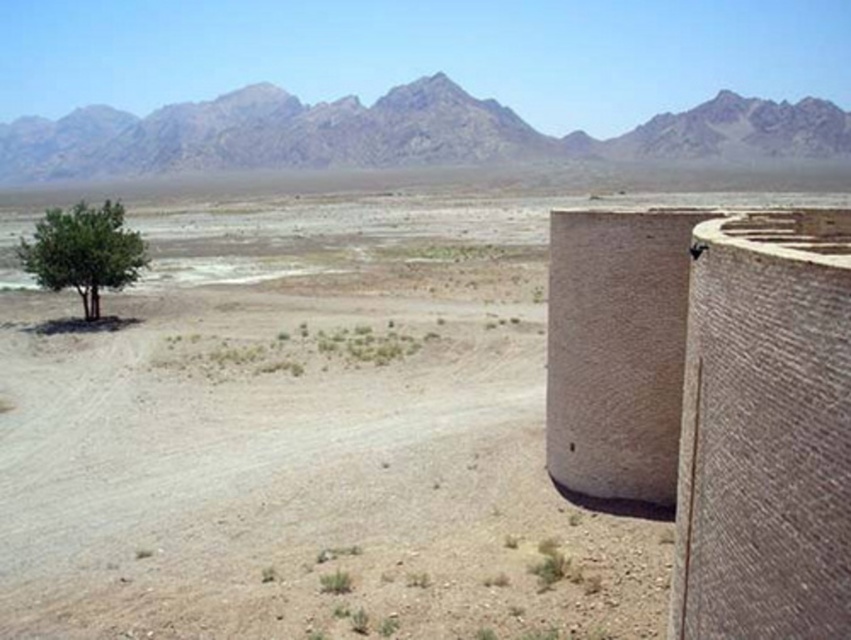
Question: Estimate the real-world distances between objects in this image. Which object is farther from the brown textured fort at right?

Choices:
 (A) rugged stone mountain at upper center
 (B) dull brown dirt at center

Answer: (A)

Question: Is dull brown dirt at center closer to the viewer compared to green leafy tree at left?

Choices:
 (A) yes
 (B) no

Answer: (A)

Question: Which point is closer to the camera?

Choices:
 (A) dull brown dirt at center
 (B) rugged stone mountain at upper center
 (C) brown textured fort at right

Answer: (C)

Question: Where is brown textured fort at right located in relation to green leafy tree at left in the image?

Choices:
 (A) left
 (B) right

Answer: (B)

Question: Which of the following is the farthest from the observer?

Choices:
 (A) (530, 538)
 (B) (695, 458)
 (C) (674, 122)
 (D) (43, 259)

Answer: (C)

Question: Does dull brown dirt at center appear on the right side of brown textured fort at right?

Choices:
 (A) no
 (B) yes

Answer: (A)